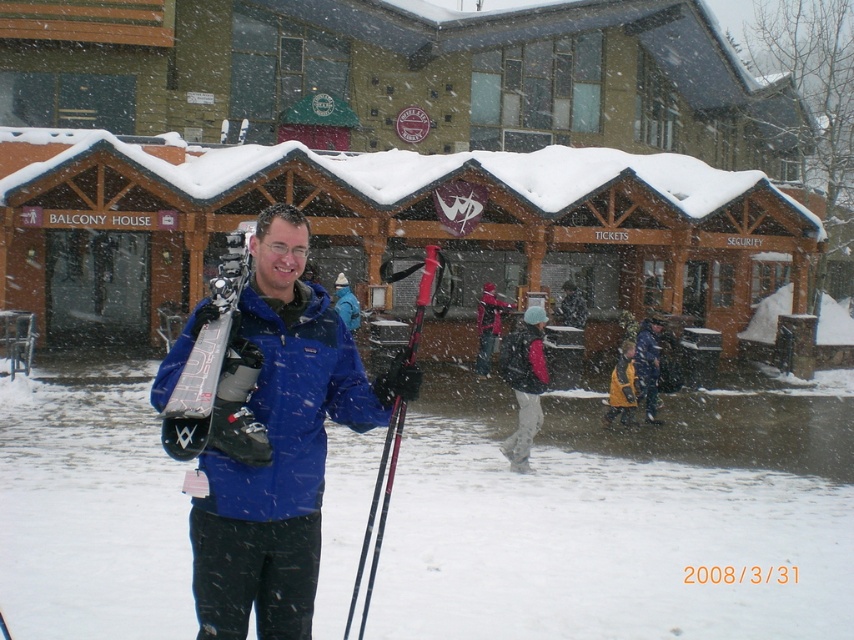
Question: Is brown wooden log cabin at center further to camera compared to matte black ski at center?

Choices:
 (A) no
 (B) yes

Answer: (B)

Question: Can you confirm if black matte jacket at center is positioned above yellow wool sweater at lower center?

Choices:
 (A) no
 (B) yes

Answer: (A)

Question: Which object appears farthest from the camera in this image?

Choices:
 (A) black matte jacket at center
 (B) yellow matte jacket at center
 (C) brown wooden log cabin at center

Answer: (C)

Question: Which object is positioned farthest from the yellow matte jacket at center?

Choices:
 (A) blue softshell jacket at center
 (B) brown wooden log cabin at center
 (C) black matte jacket at center
 (D) yellow wool sweater at lower center

Answer: (A)

Question: Is blue softshell jacket at center wider than yellow matte jacket at center?

Choices:
 (A) yes
 (B) no

Answer: (A)

Question: Which of the following is the closest to the observer?

Choices:
 (A) (32, 284)
 (B) (513, 344)
 (C) (272, 570)

Answer: (C)